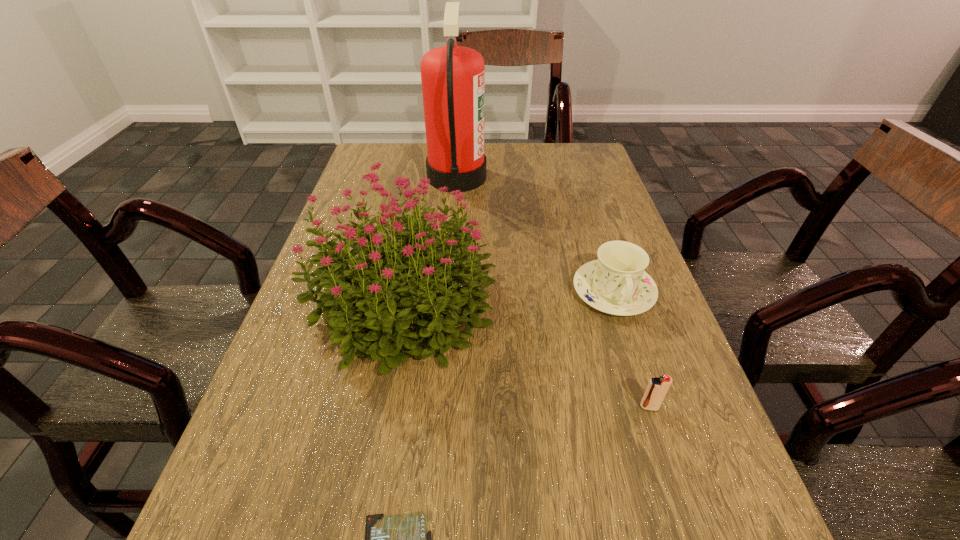
Where is `the tallest object`? The width and height of the screenshot is (960, 540). the tallest object is located at coordinates (453, 77).

Locate an element on the screen. The image size is (960, 540). the farthest object is located at coordinates (453, 77).

You are a GUI agent. You are given a task and a screenshot of the screen. Output one action in this format:
    pyautogui.click(x=<x>, y=<y>)
    Task: Click on the second tallest object
    
    Given the screenshot: What is the action you would take?
    pyautogui.click(x=360, y=306)

Find the location of a particular element. The image size is (960, 540). chinaware is located at coordinates (616, 283).

I want to click on the fourth farthest object, so click(657, 388).

Find the location of `igniter`. igniter is located at coordinates (657, 388).

Where is `blank space located 0.350m at the nozzle of the farthest object`? blank space located 0.350m at the nozzle of the farthest object is located at coordinates coord(606,177).

I want to click on free point located on the front of the bouquet, so click(x=366, y=509).

Where is `vacant area situated 0.070m on the handle side of the chinaware`? This screenshot has width=960, height=540. vacant area situated 0.070m on the handle side of the chinaware is located at coordinates (633, 350).

The width and height of the screenshot is (960, 540). Identify the location of free space located 0.120m on the left of the igniter. (567, 407).